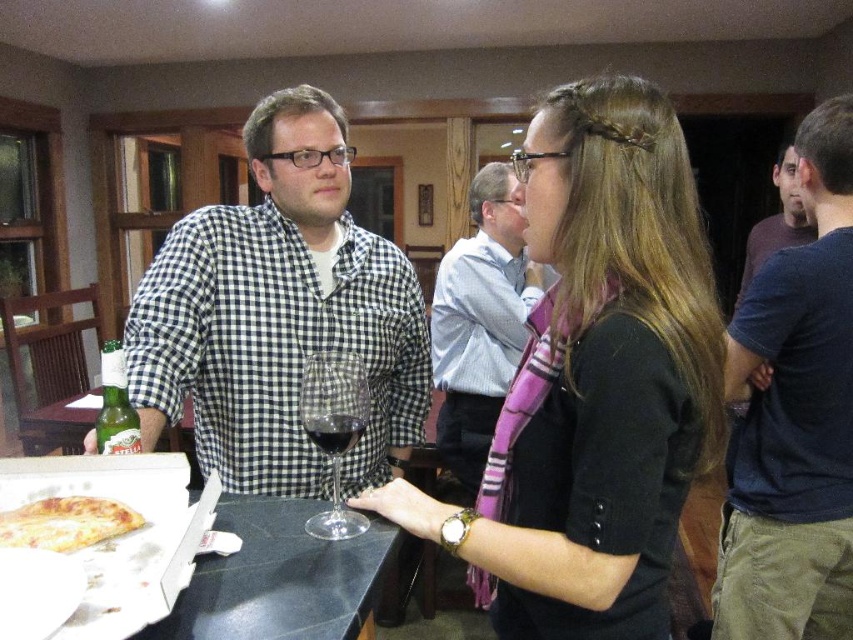
You are a guest at this party and want to place a rectangular gift box on the table. The gift box is as wide as the checkered fabric shirt at left. Is there enough space between the golden crispy pizza at center and the edge of the table to place the gift box?

The checkered fabric shirt at left is wider than the golden crispy pizza at center. Since the gift box has the same width as the checkered fabric shirt at left, it may not fit between the golden crispy pizza at center and the table edge unless there is sufficient space. However, without knowing the exact dimensions of the table or the distance between the pizza and the edge, it is uncertain if the space is adequate.

You are at a party and want to grab a drink. You see a transparent glass at center and a dark glass wine at center on the table. Which one is closer to you?

The transparent glass at center is closer to you because it is in front of the dark glass wine at center.

Looking at this image, you are at a party and want to grab a drink. There is a transparent glass at center and a dark glass wine at center on the table. Which one is closer to you?

Both the transparent glass at center and dark glass wine at center are exactly 1.35 inches apart from each other, so neither is closer than the other.